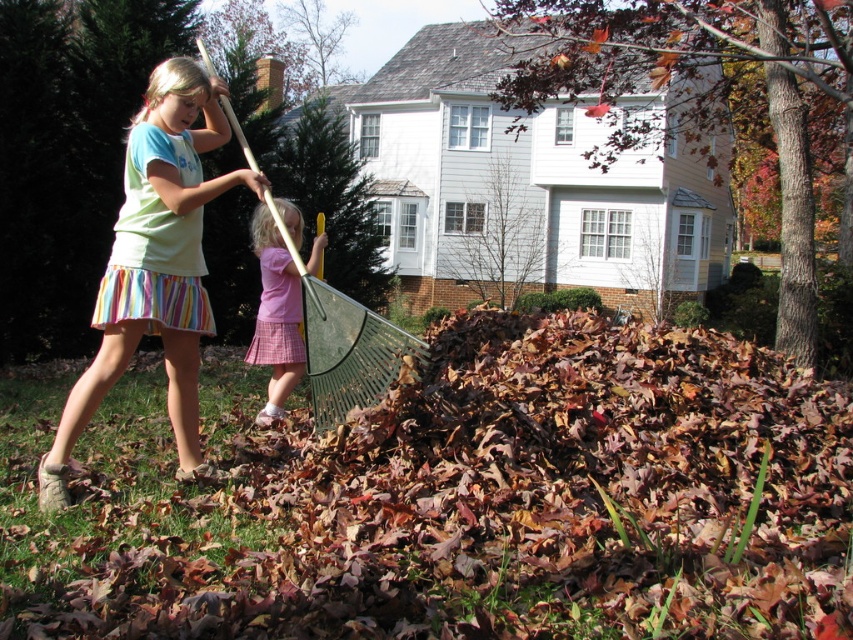
You are standing at the point marked as point (778, 404) in the image. The distance between you and the viewer is 4.71 meters. If you want to walk towards the house in the background, which direction should you go?

The house is in the background, so you should walk away from the viewer towards the house.

You are a parent trying to help your child clean up the yard. You see the brown dry leaves at center and the green plastic shovel at center. Which item is closer to the two story house with brick accents in the background?

The brown dry leaves at center are closer to the two story house with brick accents in the background because the green plastic shovel at center is 5.18 feet away from them.

You are standing at the point marked as point (492, 504) in the image. What is under your feet?

The point (492, 504) is on brown dry leaves at center.